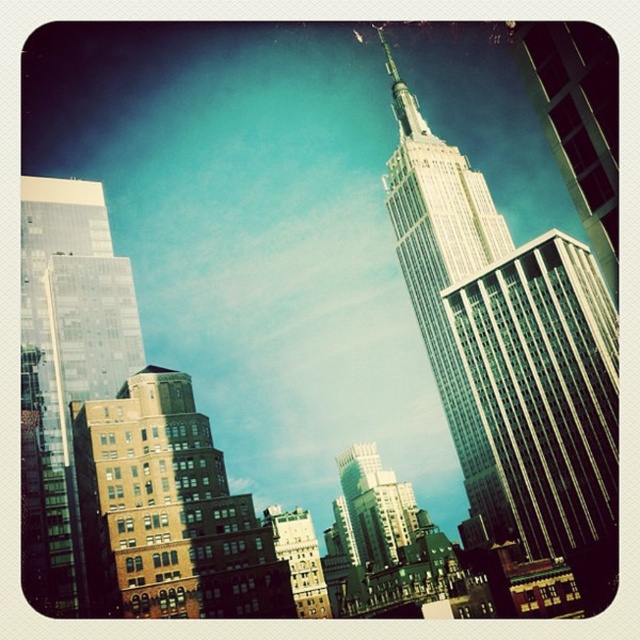
You are standing at the observation deck of the Empire State Building and looking out. There are two points in your view, one at point coordinates point(99, 404) and another at point(464, 445). Which point is closer to you?

Point(99, 404) is closer to you than point(464, 445).

You are a tourist standing at the observation deck of the white glass tower at center. You see the glassy skyscraper at upper right through your binoculars. Which building is taller?

The white glass tower at center is taller than the glassy skyscraper at upper right, so the building you are currently in is taller.